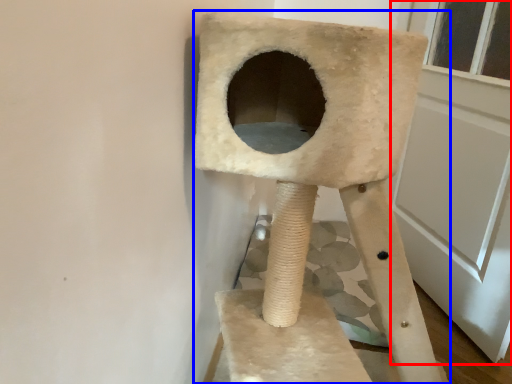
Question: Which point is closer to the camera, screen door (highlighted by a red box) or furniture (highlighted by a blue box)?

Choices:
 (A) screen door
 (B) furniture

Answer: (B)